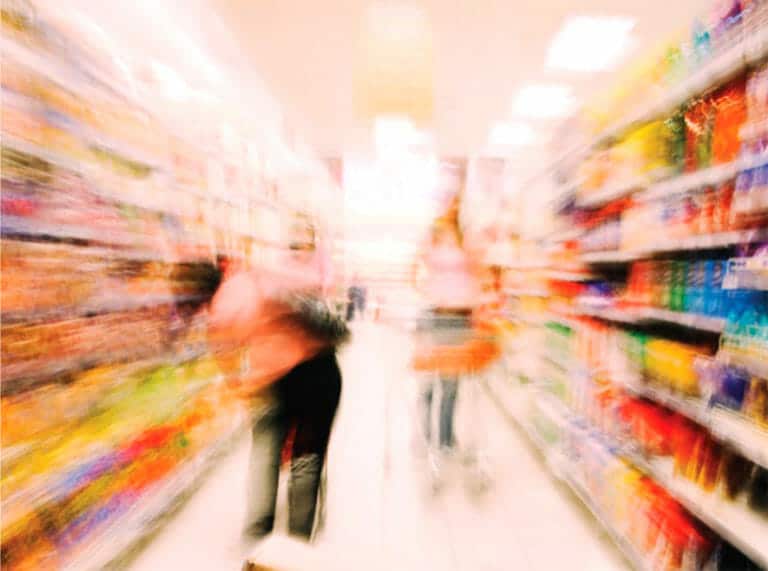
Where is `floor`? The width and height of the screenshot is (768, 571). floor is located at coordinates click(442, 526).